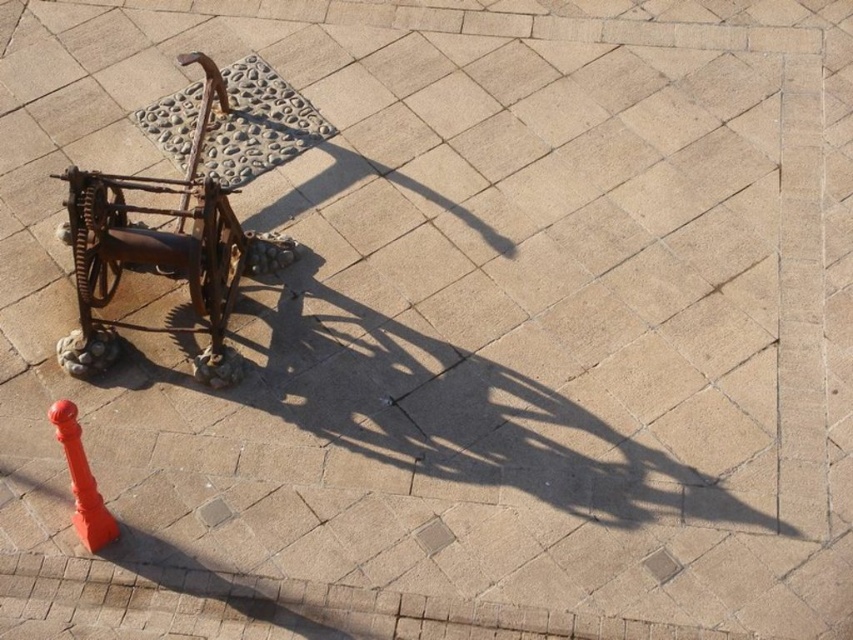
You are standing in a park and see the rusty metal baby carriage at center and the orange matte traffic cone at lower left. Which object is closer to you?

The rusty metal baby carriage at center is closer to you because it is further to the viewer than the orange matte traffic cone at lower left.

You are standing at the lower left corner of the paved area and want to walk to the rusty metal baby carriage at center. Which direction should you move relative to the orange matte traffic cone at lower left?

You should move to the right of the orange matte traffic cone at lower left to reach the rusty metal baby carriage at center since it is positioned to the right of the cone.

You are standing in front of the weathered metal object on the paved surface. You notice two points marked on the ground at coordinates point (274,237) and point (56,426). Which point is closer to you?

Point (274,237) is further to the camera than point (56,426), so the point closer to you is point (56,426).